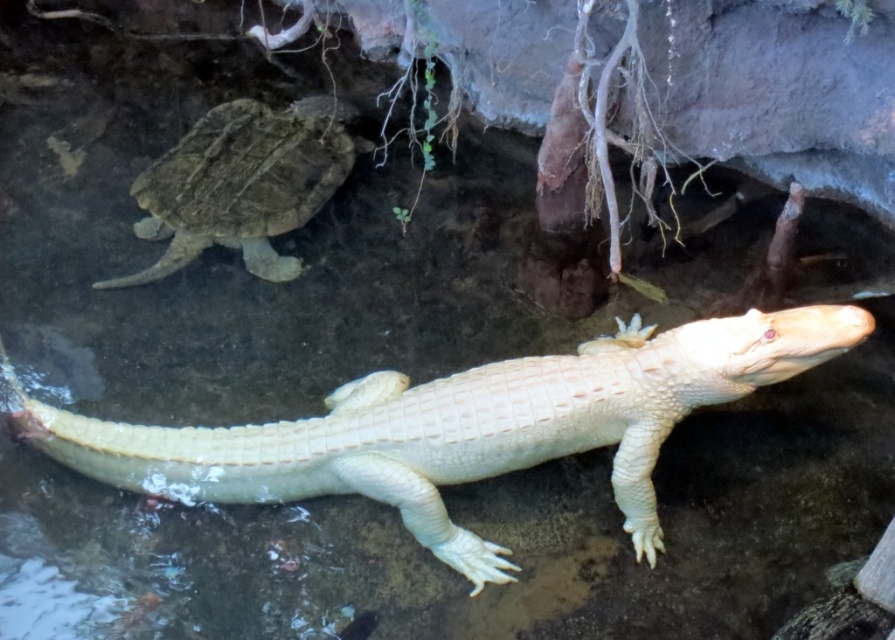
Between white scaly crocodile at center and leathery brown tortoise at upper left, which one appears on the left side from the viewer's perspective?

leathery brown tortoise at upper left is more to the left.

Does white scaly crocodile at center have a smaller size compared to leathery brown tortoise at upper left?

Incorrect, white scaly crocodile at center is not smaller in size than leathery brown tortoise at upper left.

Is point (186, 481) closer to viewer compared to point (239, 125)?

Yes.

This screenshot has height=640, width=895. I want to click on white scaly crocodile at center, so click(x=465, y=426).